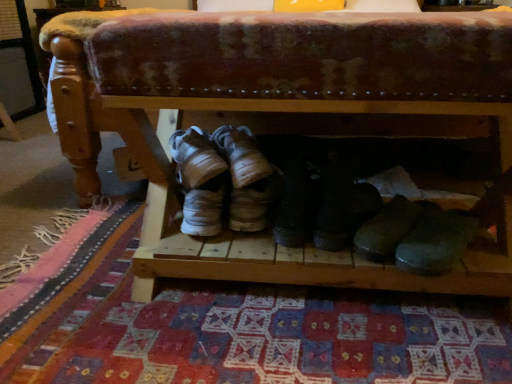
Question: From a real-world perspective, is wooden shoe rack at center located higher than white suede sneakers at center, which is counted as the 1th footwear, starting from the left?

Choices:
 (A) yes
 (B) no

Answer: (A)

Question: Is wooden shoe rack at center thinner than white suede sneakers at center, positioned as the 3th footwear in right-to-left order?

Choices:
 (A) no
 (B) yes

Answer: (A)

Question: Is wooden shoe rack at center located outside white suede sneakers at center, which is counted as the 1th footwear, starting from the left?

Choices:
 (A) no
 (B) yes

Answer: (B)

Question: Can you confirm if wooden shoe rack at center is taller than white suede sneakers at center, which is counted as the 1th footwear, starting from the left?

Choices:
 (A) no
 (B) yes

Answer: (B)

Question: Can you confirm if wooden shoe rack at center is shorter than white suede sneakers at center, positioned as the 3th footwear in right-to-left order?

Choices:
 (A) no
 (B) yes

Answer: (A)

Question: Is white suede sneakers at center, positioned as the 3th footwear in right-to-left order, spatially inside black leather boots at center, the 2th footwear positioned from the left, or outside of it?

Choices:
 (A) outside
 (B) inside

Answer: (A)

Question: Is point (220, 180) closer or farther from the camera than point (305, 210)?

Choices:
 (A) farther
 (B) closer

Answer: (A)

Question: Would you say white suede sneakers at center, positioned as the 3th footwear in right-to-left order, is to the left or to the right of black leather boots at center, the 2th footwear positioned from the left, in the picture?

Choices:
 (A) right
 (B) left

Answer: (B)

Question: From the image's perspective, is white suede sneakers at center, positioned as the 3th footwear in right-to-left order, located above or below black leather boots at center, the second footwear when ordered from right to left?

Choices:
 (A) below
 (B) above

Answer: (B)

Question: In terms of width, does black leather boot at center, arranged as the 3th footwear when viewed from the left, look wider or thinner when compared to white suede sneakers at center, which is counted as the 1th footwear, starting from the left?

Choices:
 (A) thin
 (B) wide

Answer: (A)

Question: Which is correct: black leather boot at center, marked as the 1th footwear in a right-to-left arrangement, is inside white suede sneakers at center, which is counted as the 1th footwear, starting from the left, or outside of it?

Choices:
 (A) inside
 (B) outside

Answer: (B)

Question: Relative to white suede sneakers at center, which is counted as the 1th footwear, starting from the left, is black leather boot at center, arranged as the 3th footwear when viewed from the left, in front or behind?

Choices:
 (A) behind
 (B) front

Answer: (B)

Question: From the image's perspective, is black leather boot at center, marked as the 1th footwear in a right-to-left arrangement, located above or below white suede sneakers at center, which is counted as the 1th footwear, starting from the left?

Choices:
 (A) below
 (B) above

Answer: (A)

Question: In terms of size, does wooden shoe rack at center appear bigger or smaller than black leather boot at center, marked as the 1th footwear in a right-to-left arrangement?

Choices:
 (A) big
 (B) small

Answer: (A)

Question: Do you think wooden shoe rack at center is within black leather boot at center, arranged as the 3th footwear when viewed from the left, or outside of it?

Choices:
 (A) outside
 (B) inside

Answer: (A)